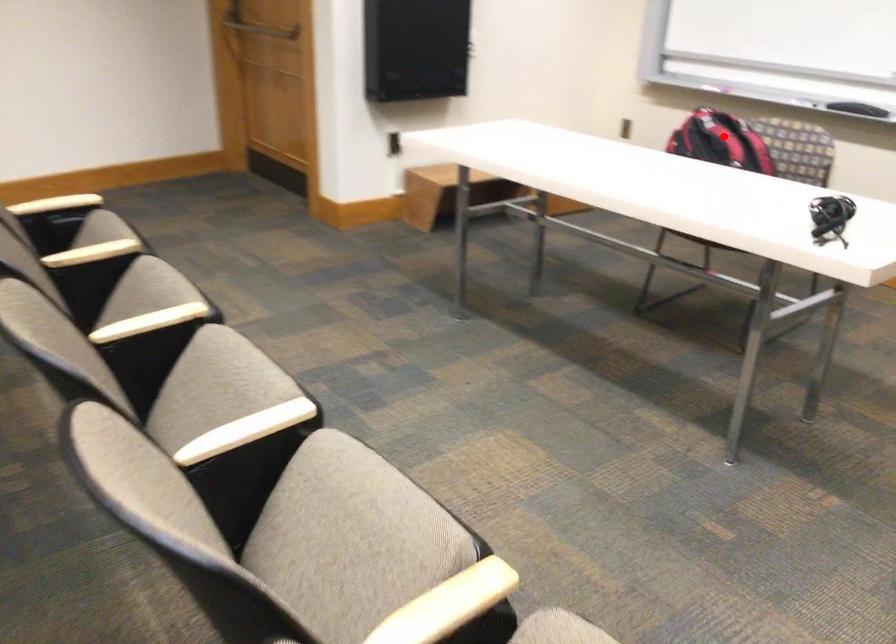
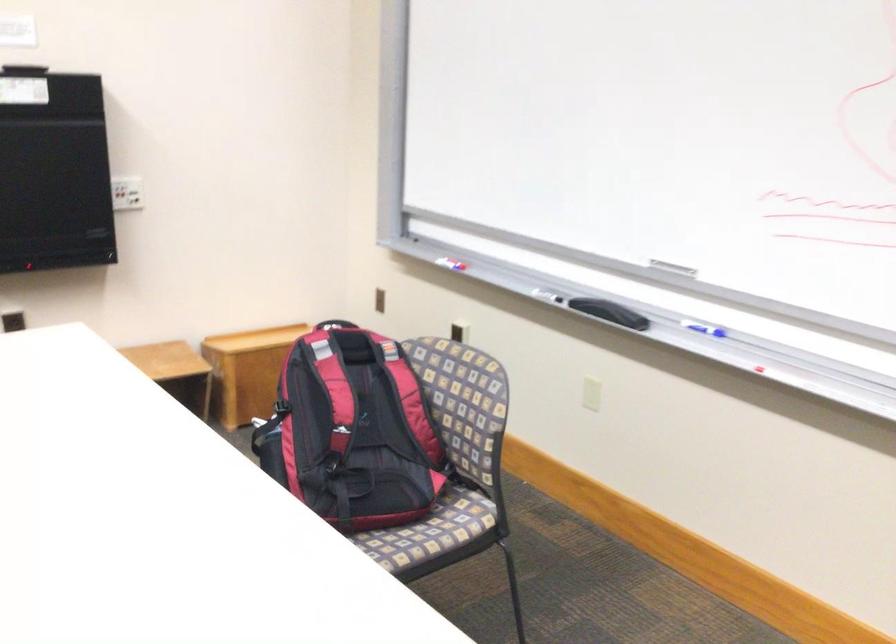
The point at the highlighted location is marked in the first image. Where is the corresponding point in the second image?

(334, 391)